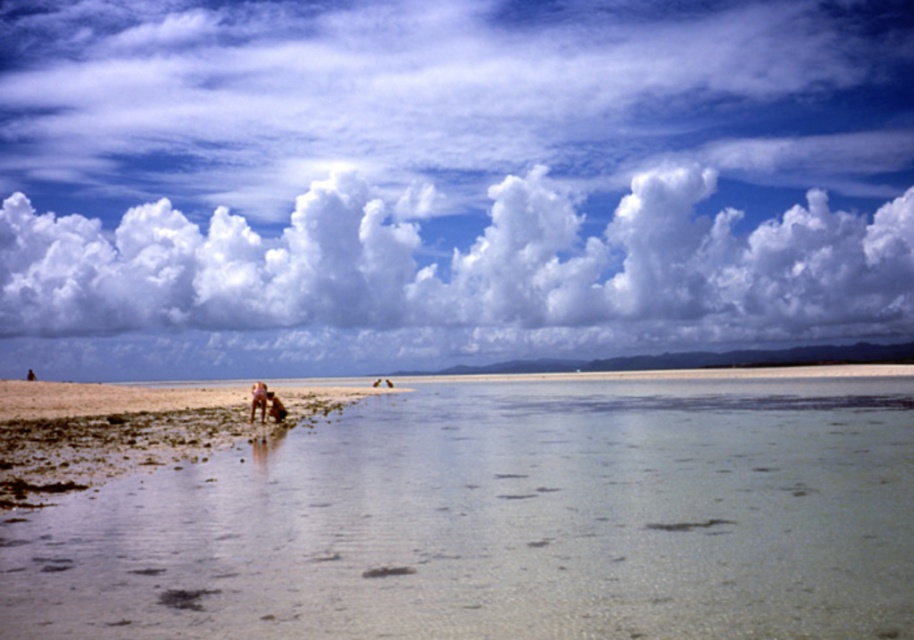
Question: Which object is the closest to the clear glass water at center?

Choices:
 (A) white fluffy cloud at upper center
 (B) beige fabric dog at center
 (C) brown leather bag at center

Answer: (C)

Question: Can you confirm if light brown sand at lower left is positioned above brown leather bag at center?

Choices:
 (A) no
 (B) yes

Answer: (A)

Question: Which object appears closest to the camera in this image?

Choices:
 (A) beige fabric dog at center
 (B) clear glass water at center
 (C) white fluffy cloud at upper center

Answer: (B)

Question: Can you confirm if clear glass water at center is positioned to the left of light brown sand at lower left?

Choices:
 (A) no
 (B) yes

Answer: (A)

Question: Among these objects, which one is farthest from the camera?

Choices:
 (A) white fluffy cloud at upper center
 (B) light brown sand at lower left
 (C) brown leather bag at center
 (D) clear glass water at center

Answer: (A)

Question: In this image, where is clear glass water at center located relative to light brown sand at lower left?

Choices:
 (A) left
 (B) right

Answer: (B)